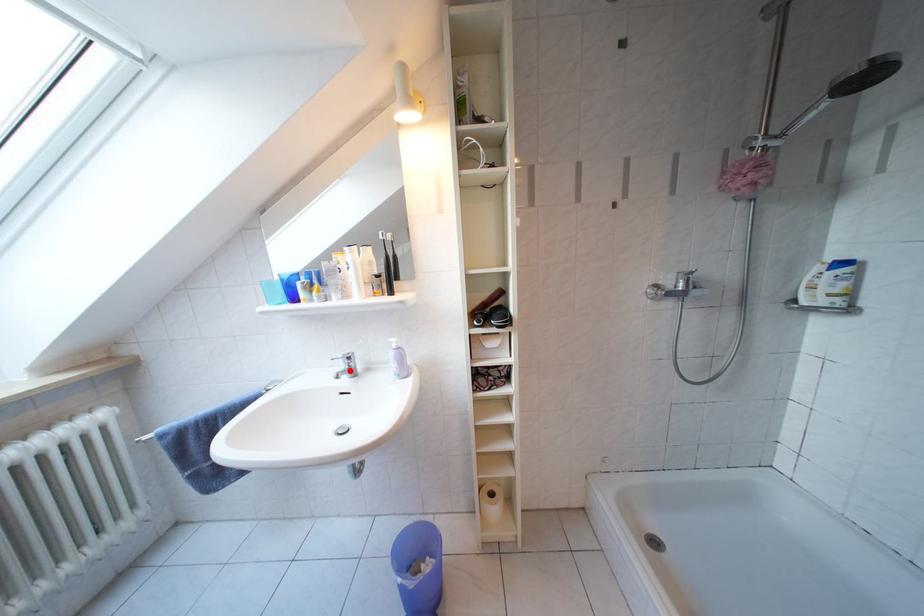
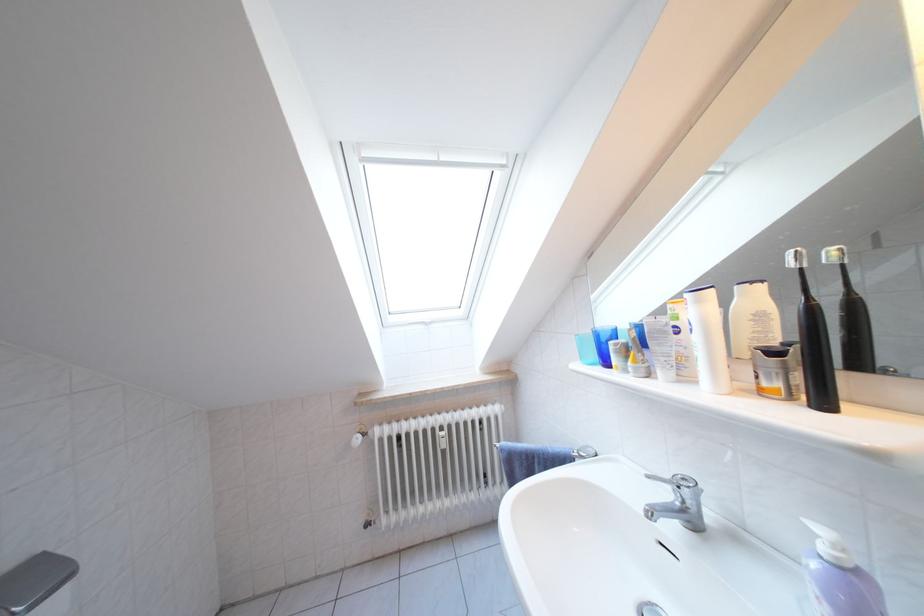
Question: I am providing you with two images of the same scene from different viewpoints. Given a red point in image1, look at the same physical point in image2. Is it:

Choices:
 (A) Closer to the viewpoint
 (B) Farther from the viewpoint

Answer: (B)